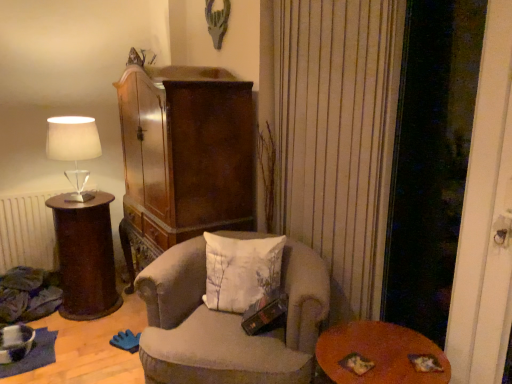
Describe the element at coordinates (85, 256) in the screenshot. I see `brown wood side table at left` at that location.

This screenshot has height=384, width=512. Describe the element at coordinates (431, 160) in the screenshot. I see `transparent glass screen door at right` at that location.

In order to click on velvet beige armchair at center in this screenshot , I will do `click(227, 323)`.

Describe the element at coordinates (227, 323) in the screenshot. I see `velvet beige armchair at center` at that location.

You are a GUI agent. You are given a task and a screenshot of the screen. Output one action in this format:
    pyautogui.click(x=<x>, y=<y>)
    Task: Click on the brown wood side table at left
    This screenshot has height=384, width=512.
    Given the screenshot: What is the action you would take?
    pyautogui.click(x=85, y=256)

How much distance is there between brown wood side table at left and white cotton pillow at center?

brown wood side table at left is 1.08 meters away from white cotton pillow at center.

Would you say white cotton pillow at center is part of brown wood side table at left's contents?

Actually, white cotton pillow at center is outside brown wood side table at left.

Which is in front, point (118, 299) or point (241, 286)?

The point (241, 286) is closer to the camera.

Is brown wood side table at left facing away from white cotton pillow at center?

→ No, brown wood side table at left is not facing the opposite direction of white cotton pillow at center.

Is white fabric lampshade at left oriented towards white cotton pillow at center?

No.

Based on the photo, which is behind, white fabric lampshade at left or white cotton pillow at center?

white fabric lampshade at left is behind.

From a real-world perspective, is white fabric lampshade at left under white cotton pillow at center?

No, from a real-world perspective, white fabric lampshade at left is not beneath white cotton pillow at center.

Locate an element on the screen. The image size is (512, 384). lamp behind the white cotton pillow at center is located at coordinates (74, 149).

Considering the relative positions of wooden round table at lower right and white cotton pillow at center in the image provided, is wooden round table at lower right in front of white cotton pillow at center?

Yes, wooden round table at lower right is in front of white cotton pillow at center.

From the image's perspective, between wooden round table at lower right and white cotton pillow at center, who is located below?

wooden round table at lower right appears lower in the image.

What are the coordinates of `table in front of the white cotton pillow at center` in the screenshot? It's located at (380, 355).

Is brown wood side table at left positioned far away from transparent glass screen door at right?

Indeed, brown wood side table at left is not near transparent glass screen door at right.

From a real-world perspective, which is physically above, brown wood side table at left or transparent glass screen door at right?

From a 3D spatial view, transparent glass screen door at right is above.

Who is taller, brown wood side table at left or transparent glass screen door at right?

transparent glass screen door at right is taller.

Is brown wood side table at left positioned with its back to transparent glass screen door at right?

No.

Which is correct: white cotton pillow at center is inside transparent glass screen door at right, or outside of it?

white cotton pillow at center is not inside transparent glass screen door at right, it's outside.

Is transparent glass screen door at right at the back of white cotton pillow at center?

No, white cotton pillow at center is not facing away from transparent glass screen door at right.

Based on their positions, is white cotton pillow at center located to the left or right of transparent glass screen door at right?

white cotton pillow at center is positioned on transparent glass screen door at right's left side.

From the image's perspective, which object appears higher, white cotton pillow at center or transparent glass screen door at right?

From the image's view, transparent glass screen door at right is above.

Considering the sizes of objects transparent glass screen door at right and brown wood side table at left in the image provided, who is shorter, transparent glass screen door at right or brown wood side table at left?

Standing shorter between the two is brown wood side table at left.

Does transparent glass screen door at right come in front of brown wood side table at left?

Yes, it is.

Is point (442, 98) less distant than point (106, 193)?

Yes.

Is transparent glass screen door at right facing away from brown wood side table at left?

No, transparent glass screen door at right's orientation is not away from brown wood side table at left.

Which is behind, white cotton pillow at center or velvet beige armchair at center?

white cotton pillow at center is further away from the camera.

Considering the sizes of objects white cotton pillow at center and velvet beige armchair at center in the image provided, who is bigger, white cotton pillow at center or velvet beige armchair at center?

Bigger between the two is velvet beige armchair at center.

Is white cotton pillow at center at the right side of velvet beige armchair at center?

Indeed, white cotton pillow at center is positioned on the right side of velvet beige armchair at center.

Are white cotton pillow at center and velvet beige armchair at center making contact?

No.

Identify the location of desk below the white cotton pillow at center (from a real-world perspective). (85, 256).

Where is `pillow below the white fabric lampshade at left (from the image's perspective)`? This screenshot has width=512, height=384. pillow below the white fabric lampshade at left (from the image's perspective) is located at coordinates 241,271.

Looking at the image, which one is located further to brown wood side table at left, wooden round table at lower right or white cotton pillow at center?

wooden round table at lower right is positioned further to the anchor brown wood side table at left.

Estimate the real-world distances between objects in this image. Which object is closer to velvet beige armchair at center, white fabric lampshade at left or white cotton pillow at center?

white cotton pillow at center is closer to velvet beige armchair at center.

Looking at the image, which one is located closer to white cotton pillow at center, white fabric lampshade at left or brown wood side table at left?

Based on the image, brown wood side table at left appears to be nearer to white cotton pillow at center.

Considering their positions, is transparent glass screen door at right positioned further to brown wood side table at left than velvet beige armchair at center?

The object further to brown wood side table at left is transparent glass screen door at right.

Considering their positions, is white fabric lampshade at left positioned closer to transparent glass screen door at right than velvet beige armchair at center?

velvet beige armchair at center is positioned closer to the anchor transparent glass screen door at right.

Which object lies nearer to the anchor point brown wood side table at left, white fabric lampshade at left or white cotton pillow at center?

white fabric lampshade at left lies closer to brown wood side table at left than the other object.

Considering their positions, is velvet beige armchair at center positioned closer to transparent glass screen door at right than brown wood side table at left?

velvet beige armchair at center is positioned closer to the anchor transparent glass screen door at right.

Based on their spatial positions, is transparent glass screen door at right or velvet beige armchair at center closer to white cotton pillow at center?

Among the two, velvet beige armchair at center is located nearer to white cotton pillow at center.

You are a GUI agent. You are given a task and a screenshot of the screen. Output one action in this format:
    pyautogui.click(x=<x>, y=<y>)
    Task: Click on the pillow situated between white fabric lampshade at left and transparent glass screen door at right from left to right
    This screenshot has height=384, width=512.
    Given the screenshot: What is the action you would take?
    pyautogui.click(x=241, y=271)

You are a GUI agent. You are given a task and a screenshot of the screen. Output one action in this format:
    pyautogui.click(x=<x>, y=<y>)
    Task: Click on the pillow located between velvet beige armchair at center and transparent glass screen door at right in the left-right direction
    
    Given the screenshot: What is the action you would take?
    pyautogui.click(x=241, y=271)

The width and height of the screenshot is (512, 384). What are the coordinates of `desk located between white fabric lampshade at left and wooden round table at lower right in the left-right direction` in the screenshot? It's located at (85, 256).

Where is `chair between white fabric lampshade at left and wooden round table at lower right in the horizontal direction`? chair between white fabric lampshade at left and wooden round table at lower right in the horizontal direction is located at coordinates (227, 323).